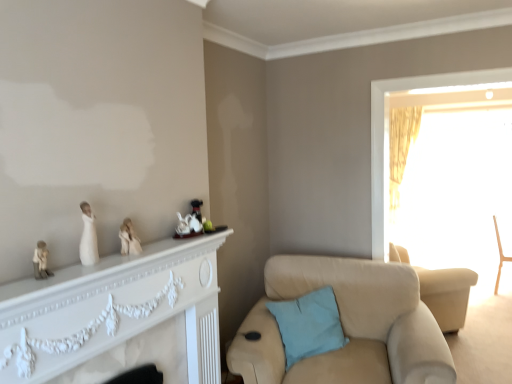
Question: From the image's perspective, is matte black teapot at center, the third toy viewed from the left, above wooden chair at right, placed as the 1th chair when sorted from right to left?

Choices:
 (A) yes
 (B) no

Answer: (A)

Question: Is the depth of matte black teapot at center, positioned as the first toy in right-to-left order, greater than that of wooden chair at right, marked as the 2th chair in a front-to-back arrangement?

Choices:
 (A) yes
 (B) no

Answer: (B)

Question: Considering the relative sizes of matte black teapot at center, positioned as the first toy in back-to-front order, and wooden chair at right, placed as the 1th chair when sorted from right to left, in the image provided, is matte black teapot at center, positioned as the first toy in back-to-front order, shorter than wooden chair at right, placed as the 1th chair when sorted from right to left,?

Choices:
 (A) yes
 (B) no

Answer: (A)

Question: Is matte black teapot at center, the third toy viewed from the left, outside of wooden chair at right, positioned as the 2th chair in left-to-right order?

Choices:
 (A) yes
 (B) no

Answer: (A)

Question: From the image's perspective, is matte black teapot at center, positioned as the first toy in back-to-front order, under wooden chair at right, placed as the 1th chair when sorted from right to left?

Choices:
 (A) no
 (B) yes

Answer: (A)

Question: Is point (327, 345) closer or farther from the camera than point (59, 340)?

Choices:
 (A) farther
 (B) closer

Answer: (A)

Question: Is light blue fabric pillow at lower center taller or shorter than white carved fireplace at upper left?

Choices:
 (A) short
 (B) tall

Answer: (A)

Question: Looking at the image, does light blue fabric pillow at lower center seem bigger or smaller compared to white carved fireplace at upper left?

Choices:
 (A) big
 (B) small

Answer: (B)

Question: Relative to white carved fireplace at upper left, is light blue fabric pillow at lower center in front or behind?

Choices:
 (A) behind
 (B) front

Answer: (A)

Question: From the image's perspective, is white porcelain teapot at center, marked as the 2th toy in a right-to-left arrangement, positioned above or below matte black teapot at center, positioned as the first toy in back-to-front order?

Choices:
 (A) below
 (B) above

Answer: (A)

Question: Relative to matte black teapot at center, placed as the 3th toy when sorted from front to back, is white porcelain teapot at center, marked as the 2th toy in a right-to-left arrangement, in front or behind?

Choices:
 (A) front
 (B) behind

Answer: (A)

Question: Is point (184, 220) positioned closer to the camera than point (195, 208)?

Choices:
 (A) closer
 (B) farther

Answer: (A)

Question: Is white porcelain teapot at center, which is counted as the 2th toy, starting from the back, situated inside matte black teapot at center, positioned as the first toy in back-to-front order, or outside?

Choices:
 (A) inside
 (B) outside

Answer: (B)

Question: From the image's perspective, is matte black teapot at center, positioned as the first toy in back-to-front order, located above or below white porcelain teapot at center, which ranks as the second toy in front-to-back order?

Choices:
 (A) below
 (B) above

Answer: (B)

Question: Is matte black teapot at center, the third toy viewed from the left, spatially inside white porcelain teapot at center, which ranks as the second toy in front-to-back order, or outside of it?

Choices:
 (A) outside
 (B) inside

Answer: (A)